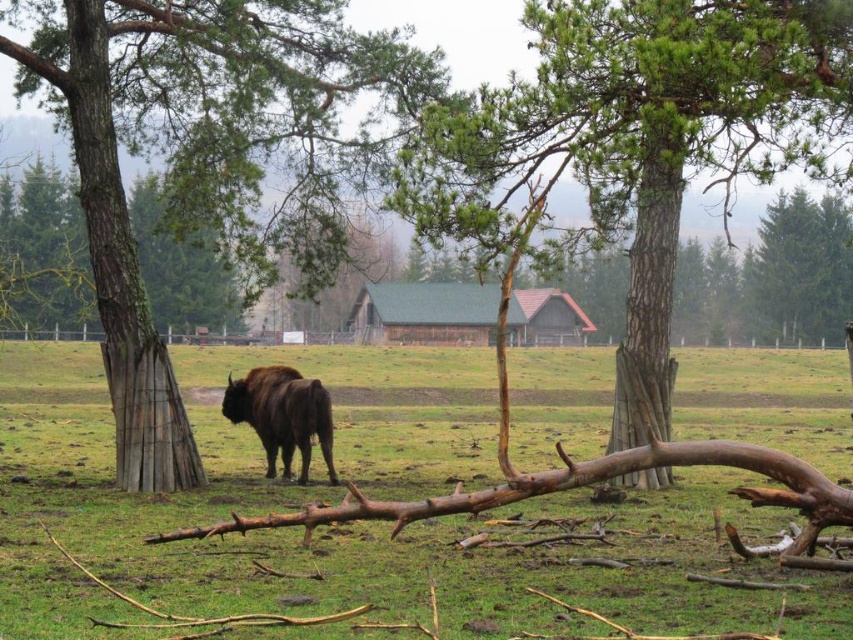
Looking at this image, you are a hiker trying to navigate through the forest. You see the brown bark tree at left and the smooth bark tree at center. Which tree should you walk towards if you want to head east?

The smooth bark tree at center is to the right of the brown bark tree at left. Since the smooth bark tree is east of the brown bark tree, you should walk towards the smooth bark tree at center to head east.

You are a wildlife photographer aiming to capture a closeup shot of the brown fur bison at center. Your camera has a maximum zoom range of 10 meters. Can you get a clear closeup without moving closer physically?

The distance between the brown fur bison at center and the viewer is 9.35 meters, which is within the camera maximum zoom range of 10 meters. Therefore, you can get a clear closeup without moving closer physically.